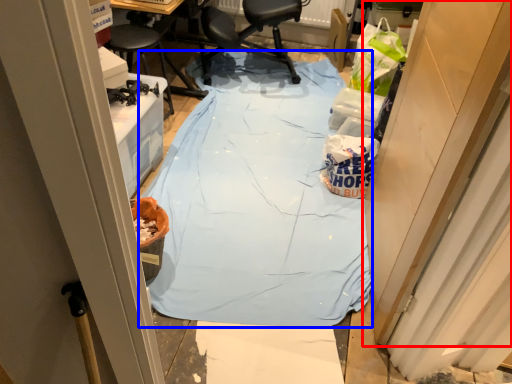
Question: Which object appears farthest to the camera in this image, door (highlighted by a red box) or tablecloth (highlighted by a blue box)?

Choices:
 (A) door
 (B) tablecloth

Answer: (B)